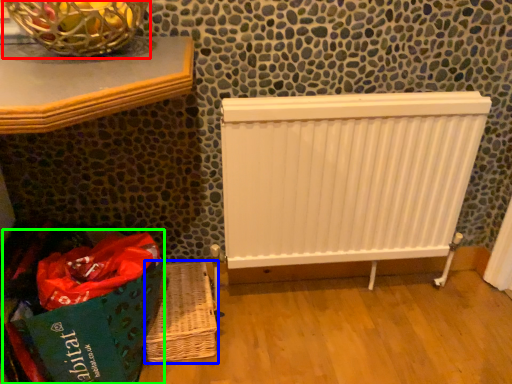
Question: Based on their relative distances, which object is farther from basket container (highlighted by a red box)? Choose from basket (highlighted by a blue box) and shopping bag (highlighted by a green box).

Choices:
 (A) basket
 (B) shopping bag

Answer: (A)